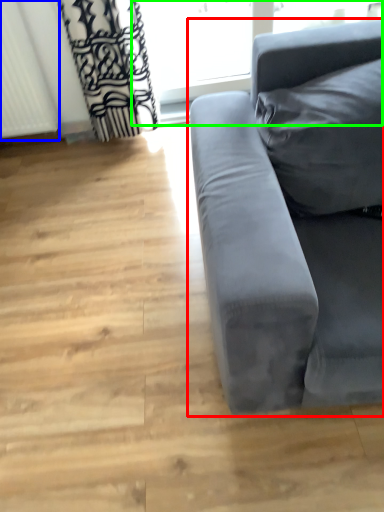
Question: Which is nearer to the studio couch (highlighted by a red box)? radiator (highlighted by a blue box) or window frame (highlighted by a green box).

Choices:
 (A) radiator
 (B) window frame

Answer: (A)